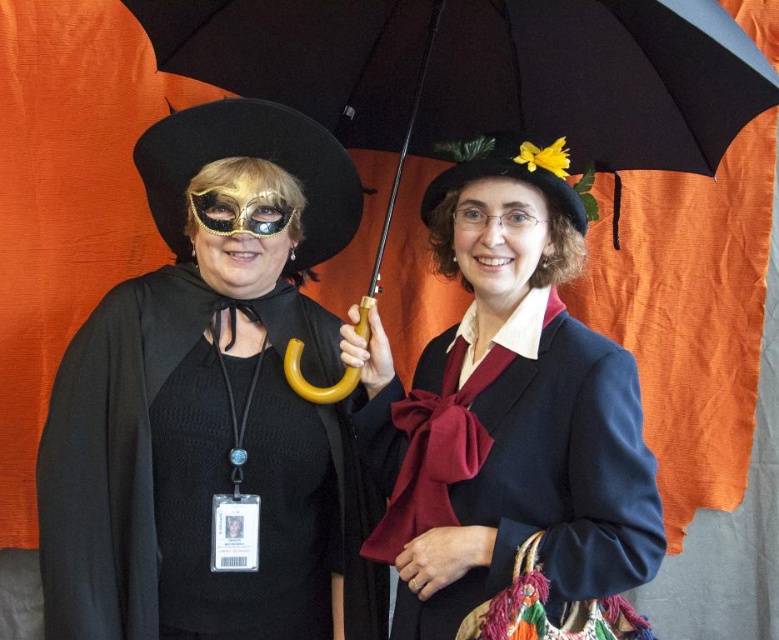
Question: Is matte blue coat at center to the right of black matte umbrella at center from the viewer's perspective?

Choices:
 (A) yes
 (B) no

Answer: (A)

Question: Which object is positioned farthest from the matte blue coat at center?

Choices:
 (A) matte black coat at center
 (B) gold metallic mask at center
 (C) black matte cape at left

Answer: (B)

Question: Which point is farther from the camera taking this photo?

Choices:
 (A) (449, 476)
 (B) (259, 218)

Answer: (B)

Question: Does matte black coat at center have a lesser width compared to black matte umbrella at center?

Choices:
 (A) no
 (B) yes

Answer: (B)

Question: Is black matte cape at left to the right of black matte umbrella at center from the viewer's perspective?

Choices:
 (A) no
 (B) yes

Answer: (A)

Question: Which point is closer to the camera?

Choices:
 (A) (325, 38)
 (B) (242, 113)

Answer: (B)